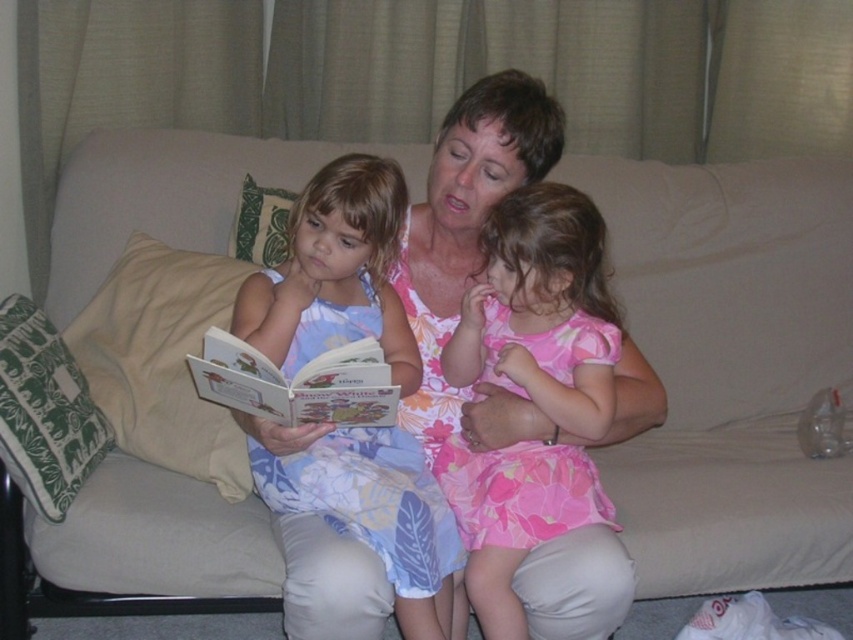
Question: Which object appears closest to the camera in this image?

Choices:
 (A) pink floral dress at center
 (B) floral fabric dress at center
 (C) matte paper book at center

Answer: (B)

Question: Where is light blue floral dress at center located in relation to pink floral dress at center in the image?

Choices:
 (A) above
 (B) below

Answer: (B)

Question: Is beige fabric pillow at left thinner than green fabric pillow at upper left?

Choices:
 (A) no
 (B) yes

Answer: (A)

Question: Estimate the real-world distances between objects in this image. Which object is farther from the light blue floral dress at center?

Choices:
 (A) beige fabric pillow at left
 (B) pink floral dress at center
 (C) green printed fabric pillow at left

Answer: (C)

Question: Can you confirm if floral fabric dress at center is wider than light blue floral dress at center?

Choices:
 (A) yes
 (B) no

Answer: (A)

Question: Which point is closer to the camera?

Choices:
 (A) (103, 449)
 (B) (238, 410)
 (C) (108, 305)
 (D) (550, 620)

Answer: (D)